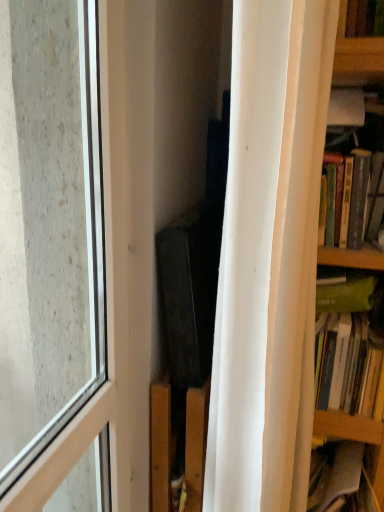
Question: Does transparent glass window at left contain hardcover books at right, acting as the first book starting from the top?

Choices:
 (A) no
 (B) yes

Answer: (A)

Question: From the image's perspective, is transparent glass window at left located beneath hardcover books at right, acting as the first book starting from the top?

Choices:
 (A) yes
 (B) no

Answer: (A)

Question: Is transparent glass window at left wider than hardcover books at right, acting as the first book starting from the top?

Choices:
 (A) no
 (B) yes

Answer: (A)

Question: Does transparent glass window at left turn towards hardcover books at right, acting as the first book starting from the top?

Choices:
 (A) no
 (B) yes

Answer: (A)

Question: Is the position of transparent glass window at left more distant than that of hardcover books at right, the 2th book ordered from the bottom?

Choices:
 (A) no
 (B) yes

Answer: (A)

Question: Are transparent glass window at left and hardcover books at right, the 2th book ordered from the bottom, beside each other?

Choices:
 (A) no
 (B) yes

Answer: (A)

Question: Could you tell me if transparent glass window at left is facing white matte curtain at right?

Choices:
 (A) no
 (B) yes

Answer: (B)

Question: From a real-world perspective, is transparent glass window at left beneath white matte curtain at right?

Choices:
 (A) yes
 (B) no

Answer: (A)

Question: From the image's perspective, would you say transparent glass window at left is positioned over white matte curtain at right?

Choices:
 (A) no
 (B) yes

Answer: (A)

Question: Does transparent glass window at left lie in front of white matte curtain at right?

Choices:
 (A) no
 (B) yes

Answer: (B)

Question: Is there a large distance between transparent glass window at left and white matte curtain at right?

Choices:
 (A) yes
 (B) no

Answer: (B)

Question: Considering the relative sizes of transparent glass window at left and white matte curtain at right in the image provided, is transparent glass window at left taller than white matte curtain at right?

Choices:
 (A) no
 (B) yes

Answer: (A)

Question: Is hardcover books at right, acting as the first book starting from the top, positioned behind white matte curtain at right?

Choices:
 (A) yes
 (B) no

Answer: (A)